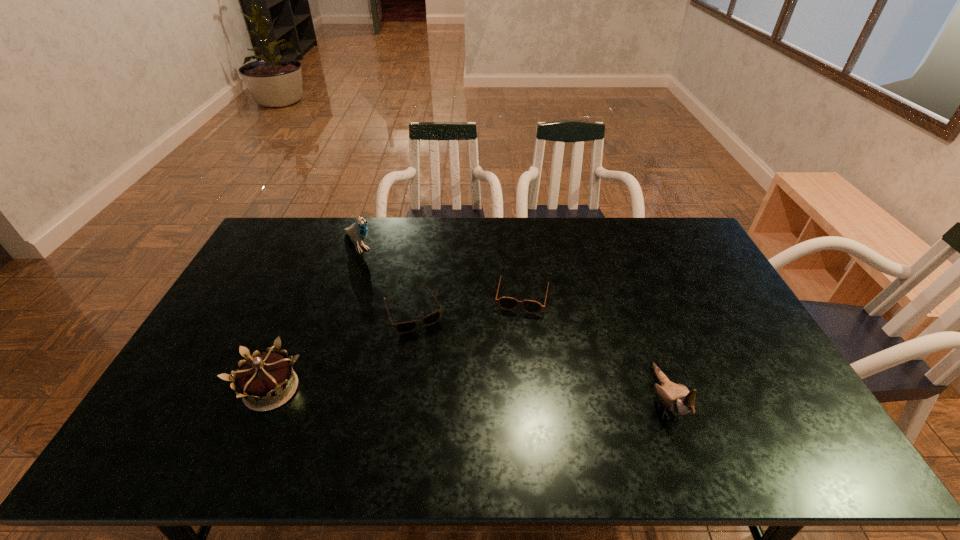
The image size is (960, 540). Find the location of `free region located 0.240m on the front-facing side of the second shortest object`. free region located 0.240m on the front-facing side of the second shortest object is located at coordinates (506, 379).

This screenshot has height=540, width=960. In order to click on free location located 0.300m on the front-facing side of the second shortest object in this screenshot , I will do `click(502, 397)`.

This screenshot has height=540, width=960. Identify the location of free location located 0.080m on the front-facing side of the second shortest object. (515, 335).

The height and width of the screenshot is (540, 960). Identify the location of vacant position located 0.170m at the face of the left bird. (390, 282).

Find the location of a particular element. This screenshot has height=540, width=960. free point located 0.230m at the face of the left bird is located at coordinates (398, 292).

Identify the location of free space located at the face of the left bird. (377, 269).

Locate an element on the screen. This screenshot has width=960, height=540. free space located on the lenses of the third object from right to left is located at coordinates (446, 378).

Identify the location of vacant point located on the lenses of the third object from right to left. (432, 349).

I want to click on blank space located 0.050m on the lenses of the third object from right to left, so click(429, 344).

Where is `object that is at the far edge`? object that is at the far edge is located at coordinates (358, 230).